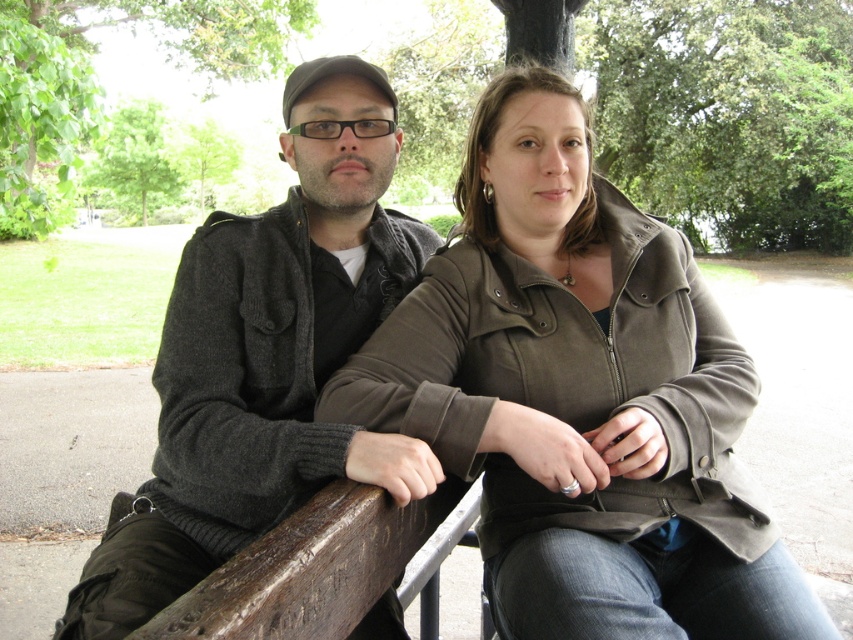
Is matte olive green jacket at center wider than dark gray sweater at center?

No, matte olive green jacket at center is not wider than dark gray sweater at center.

Can you confirm if matte olive green jacket at center is shorter than dark gray sweater at center?

Indeed, matte olive green jacket at center has a lesser height compared to dark gray sweater at center.

Between point (631, 577) and point (364, 264), which one is positioned in front?

Point (631, 577) is more forward.

Where is `matte olive green jacket at center`? The width and height of the screenshot is (853, 640). matte olive green jacket at center is located at coordinates (579, 397).